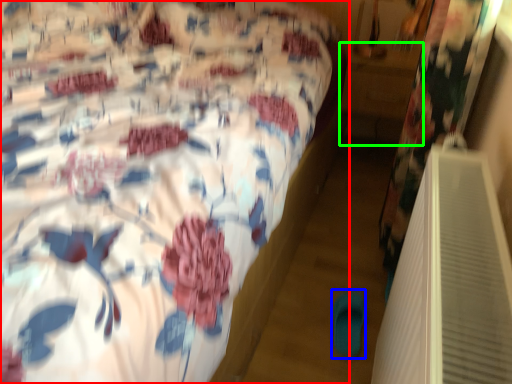
Question: Estimate the real-world distances between objects in this image. Which object is farther from bed (highlighted by a red box), slipper (highlighted by a blue box) or table (highlighted by a green box)?

Choices:
 (A) slipper
 (B) table

Answer: (B)